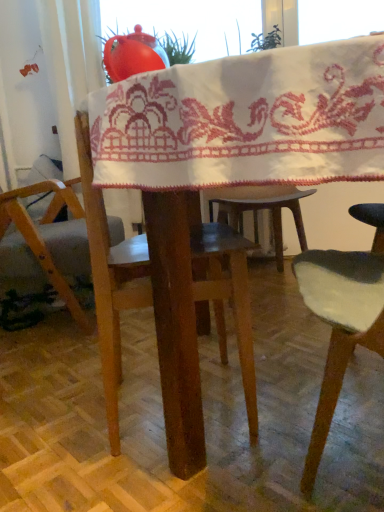
Question: Is white embroidered cloth at center facing towards wooden chair at left?

Choices:
 (A) no
 (B) yes

Answer: (A)

Question: Is white embroidered cloth at center thinner than wooden chair at left?

Choices:
 (A) yes
 (B) no

Answer: (B)

Question: Considering the relative positions of white embroidered cloth at center and wooden chair at left in the image provided, is white embroidered cloth at center behind wooden chair at left?

Choices:
 (A) no
 (B) yes

Answer: (A)

Question: Is white embroidered cloth at center shorter than wooden chair at left?

Choices:
 (A) no
 (B) yes

Answer: (B)

Question: Is white embroidered cloth at center closer to the viewer compared to wooden chair at left?

Choices:
 (A) no
 (B) yes

Answer: (B)

Question: Is white embroidered cloth at center directly adjacent to wooden chair at left?

Choices:
 (A) no
 (B) yes

Answer: (A)

Question: Can you confirm if wooden chair at left is wider than white embroidered cloth at center?

Choices:
 (A) yes
 (B) no

Answer: (B)

Question: Is wooden chair at left further to camera compared to white embroidered cloth at center?

Choices:
 (A) yes
 (B) no

Answer: (A)

Question: Are wooden chair at left and white embroidered cloth at center located far from each other?

Choices:
 (A) yes
 (B) no

Answer: (A)

Question: From a real-world perspective, is wooden chair at left positioned over white embroidered cloth at center based on gravity?

Choices:
 (A) yes
 (B) no

Answer: (B)

Question: Is wooden chair at left completely or partially outside of white embroidered cloth at center?

Choices:
 (A) yes
 (B) no

Answer: (A)

Question: Is wooden chair at left positioned before white embroidered cloth at center?

Choices:
 (A) no
 (B) yes

Answer: (A)

Question: Does wooden chair at left have a larger size compared to wooden table at center?

Choices:
 (A) yes
 (B) no

Answer: (B)